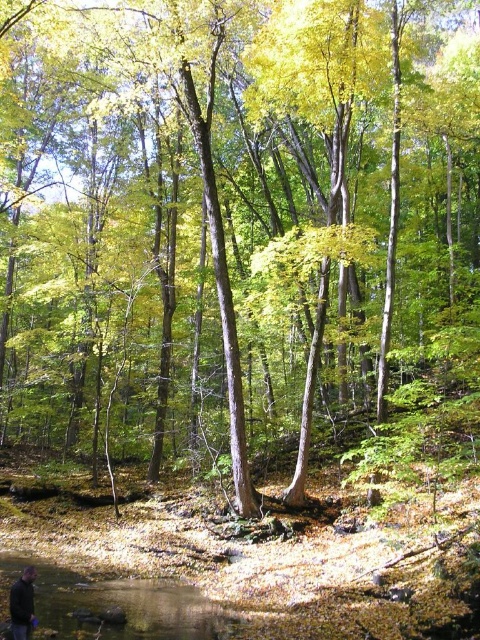
Between clear water at lower left and dark gray jacket at lower left, which one is positioned higher?

Positioned higher is dark gray jacket at lower left.

Describe the element at coordinates (123, 605) in the screenshot. I see `clear water at lower left` at that location.

Identify the location of clear water at lower left. This screenshot has width=480, height=640. (123, 605).